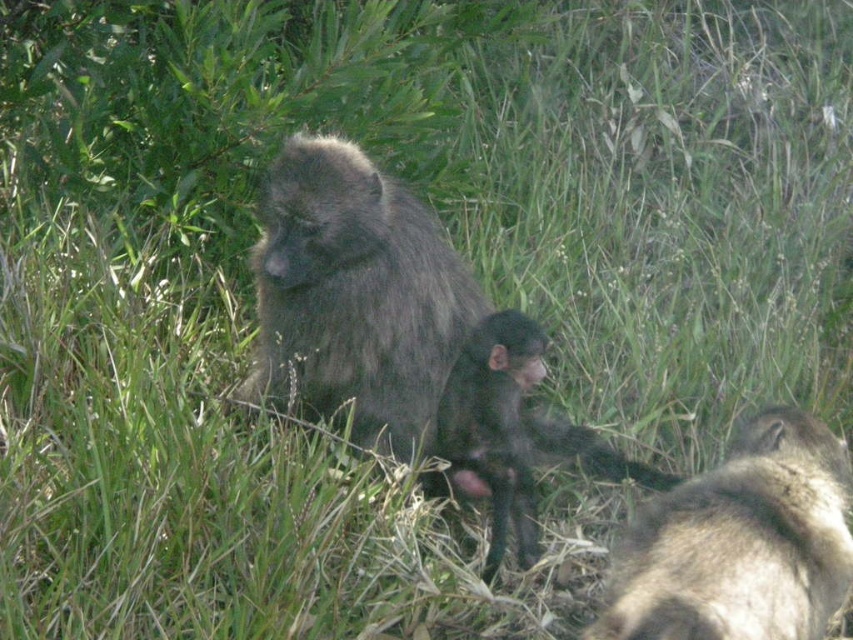
Question: Which of the following is the farthest from the observer?

Choices:
 (A) pos(248,378)
 (B) pos(483,337)
 (C) pos(762,515)

Answer: (A)

Question: Where is fuzzy brown monkey at lower right located in relation to shiny black monkey at center in the image?

Choices:
 (A) left
 (B) right

Answer: (B)

Question: Does dark gray fur monkey at center have a smaller size compared to fuzzy brown monkey at lower right?

Choices:
 (A) no
 (B) yes

Answer: (A)

Question: Which of the following is the farthest from the observer?

Choices:
 (A) coord(552,440)
 (B) coord(769,532)

Answer: (A)

Question: Which of the following is the farthest from the observer?

Choices:
 (A) (682, 570)
 (B) (381, 244)

Answer: (B)

Question: Does dark gray fur monkey at center have a smaller size compared to fuzzy brown monkey at lower right?

Choices:
 (A) yes
 (B) no

Answer: (B)